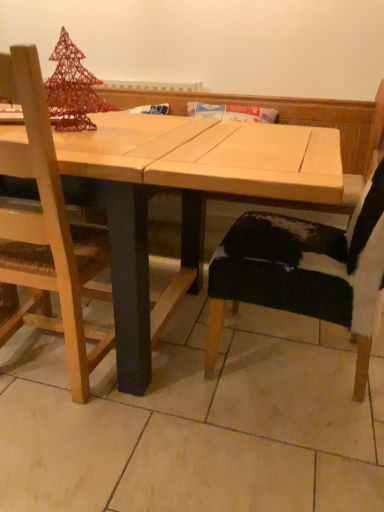
Question: Is natural wood table at center further to camera compared to wooden chair at left, positioned as the 2th chair in right-to-left order?

Choices:
 (A) no
 (B) yes

Answer: (B)

Question: From the image's perspective, is natural wood table at center located above wooden chair at left, positioned as the 2th chair in right-to-left order?

Choices:
 (A) yes
 (B) no

Answer: (A)

Question: Is natural wood table at center looking in the opposite direction of wooden chair at left, marked as the 1th chair in a left-to-right arrangement?

Choices:
 (A) no
 (B) yes

Answer: (B)

Question: Is natural wood table at center shorter than wooden chair at left, marked as the 1th chair in a left-to-right arrangement?

Choices:
 (A) no
 (B) yes

Answer: (B)

Question: Considering the relative sizes of natural wood table at center and wooden chair at left, marked as the 1th chair in a left-to-right arrangement, in the image provided, is natural wood table at center bigger than wooden chair at left, marked as the 1th chair in a left-to-right arrangement,?

Choices:
 (A) yes
 (B) no

Answer: (A)

Question: Is wooden chair at left, positioned as the 2th chair in right-to-left order, surrounded by natural wood table at center?

Choices:
 (A) yes
 (B) no

Answer: (A)

Question: Does natural wood table at center have a lesser width compared to cowhide black chair at lower right, arranged as the 2th chair when viewed from the left?

Choices:
 (A) no
 (B) yes

Answer: (A)

Question: Does natural wood table at center lie behind cowhide black chair at lower right, arranged as the 2th chair when viewed from the left?

Choices:
 (A) no
 (B) yes

Answer: (B)

Question: Does natural wood table at center appear on the right side of cowhide black chair at lower right, arranged as the 2th chair when viewed from the left?

Choices:
 (A) yes
 (B) no

Answer: (B)

Question: Is natural wood table at center directly adjacent to cowhide black chair at lower right, acting as the first chair starting from the right?

Choices:
 (A) yes
 (B) no

Answer: (B)

Question: Considering the relative sizes of natural wood table at center and cowhide black chair at lower right, acting as the first chair starting from the right, in the image provided, is natural wood table at center smaller than cowhide black chair at lower right, acting as the first chair starting from the right,?

Choices:
 (A) no
 (B) yes

Answer: (A)

Question: Considering the relative sizes of natural wood table at center and cowhide black chair at lower right, arranged as the 2th chair when viewed from the left, in the image provided, is natural wood table at center bigger than cowhide black chair at lower right, arranged as the 2th chair when viewed from the left,?

Choices:
 (A) no
 (B) yes

Answer: (B)

Question: Does wooden chair at left, positioned as the 2th chair in right-to-left order, have a greater height compared to natural wood table at center?

Choices:
 (A) yes
 (B) no

Answer: (A)